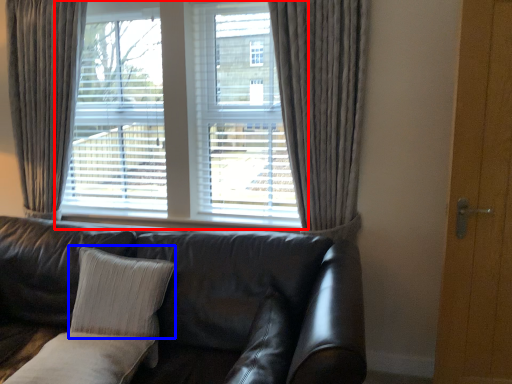
Question: Among these objects, which one is farthest to the camera, window (highlighted by a red box) or pillow (highlighted by a blue box)?

Choices:
 (A) window
 (B) pillow

Answer: (A)